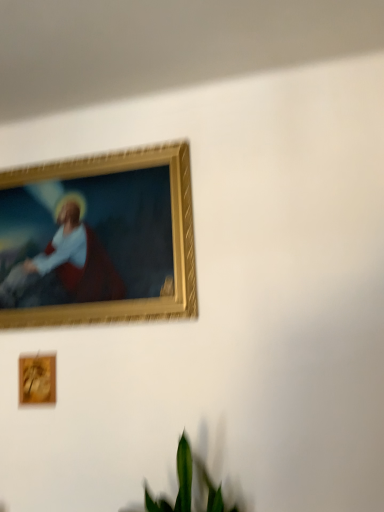
Question: From a real-world perspective, is gold-framed painting at upper left, the first picture frame from the top, located beneath green leafy plant at lower center?

Choices:
 (A) no
 (B) yes

Answer: (A)

Question: Considering the relative sizes of gold-framed painting at upper left, the first picture frame from the top, and green leafy plant at lower center in the image provided, is gold-framed painting at upper left, the first picture frame from the top, bigger than green leafy plant at lower center?

Choices:
 (A) no
 (B) yes

Answer: (A)

Question: Can you confirm if gold-framed painting at upper left, the first picture frame from the top, is positioned to the left of green leafy plant at lower center?

Choices:
 (A) yes
 (B) no

Answer: (A)

Question: Would you say green leafy plant at lower center is part of gold-framed painting at upper left, the first picture frame from the top,'s contents?

Choices:
 (A) yes
 (B) no

Answer: (B)

Question: Is gold-framed painting at upper left, arranged as the 2th picture frame when ordered from the bottom, smaller than green leafy plant at lower center?

Choices:
 (A) yes
 (B) no

Answer: (A)

Question: Is gold-framed painting at upper left, arranged as the 2th picture frame when ordered from the bottom, oriented towards green leafy plant at lower center?

Choices:
 (A) yes
 (B) no

Answer: (B)

Question: Is green leafy plant at lower center closer to camera compared to wooden frame at lower left, the 2th picture frame positioned from the top?

Choices:
 (A) no
 (B) yes

Answer: (B)

Question: From a real-world perspective, does green leafy plant at lower center sit lower than wooden frame at lower left, the 2th picture frame positioned from the top?

Choices:
 (A) yes
 (B) no

Answer: (A)

Question: Considering the relative positions of green leafy plant at lower center and wooden frame at lower left, the 2th picture frame positioned from the top, in the image provided, is green leafy plant at lower center to the left of wooden frame at lower left, the 2th picture frame positioned from the top, from the viewer's perspective?

Choices:
 (A) no
 (B) yes

Answer: (A)

Question: Does green leafy plant at lower center have a greater width compared to wooden frame at lower left, which is counted as the first picture frame, starting from the bottom?

Choices:
 (A) yes
 (B) no

Answer: (A)

Question: From the image's perspective, does green leafy plant at lower center appear higher than wooden frame at lower left, which is counted as the first picture frame, starting from the bottom?

Choices:
 (A) no
 (B) yes

Answer: (A)

Question: Is green leafy plant at lower center turned away from wooden frame at lower left, which is counted as the first picture frame, starting from the bottom?

Choices:
 (A) yes
 (B) no

Answer: (B)

Question: Considering the relative sizes of wooden frame at lower left, the 2th picture frame positioned from the top, and gold-framed painting at upper left, the first picture frame from the top, in the image provided, is wooden frame at lower left, the 2th picture frame positioned from the top, wider than gold-framed painting at upper left, the first picture frame from the top,?

Choices:
 (A) yes
 (B) no

Answer: (B)